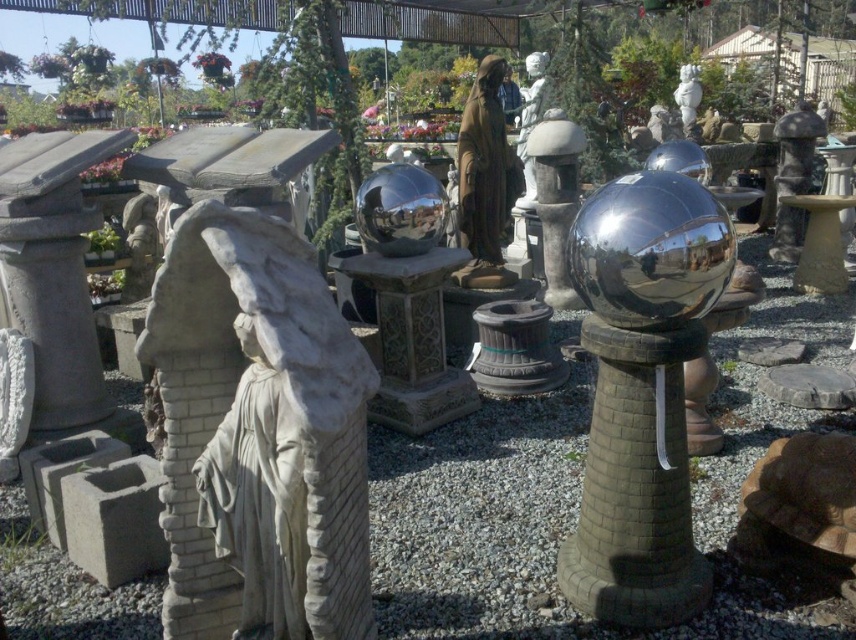
In the scene shown: You are standing in the garden center and want to know how far you are from the point marked at coordinates [498,252]. Can you determine the distance?

The point at coordinates [498,252] is 4.77 meters away from you.

You are a customer at the garden center and want to place a new decorative item between the white stone statue at left and the two large metallic spheres on the right. Based on their positions, where should you position the new item to ensure it is centered between them?

The white stone statue at left is located at point (260, 428), so the new item should be placed midway between these coordinates and the position of the two large metallic spheres on the right to ensure it is centered between them.

You are standing at the entrance of the garden center and see two points marked in the scene. Which point is closer to you, point (504, 176) or point (673, 90)?

Point (504, 176) is in front of point (673, 90), so it is closer to you.